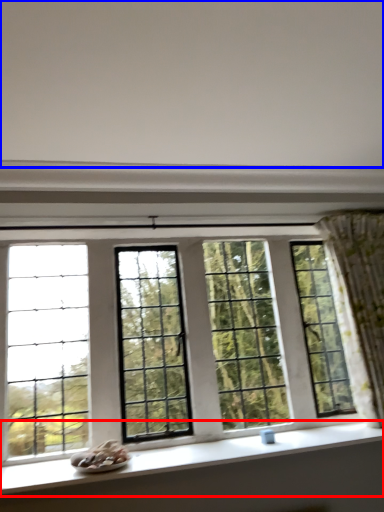
Question: Which point is closer to the camera, window sill (highlighted by a red box) or backdrop (highlighted by a blue box)?

Choices:
 (A) window sill
 (B) backdrop

Answer: (B)